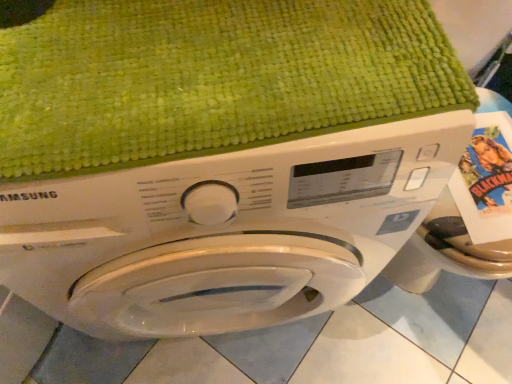
Where is `free point above green textured bath towel at upper center (from a real-world perspective)`? free point above green textured bath towel at upper center (from a real-world perspective) is located at coordinates (202, 49).